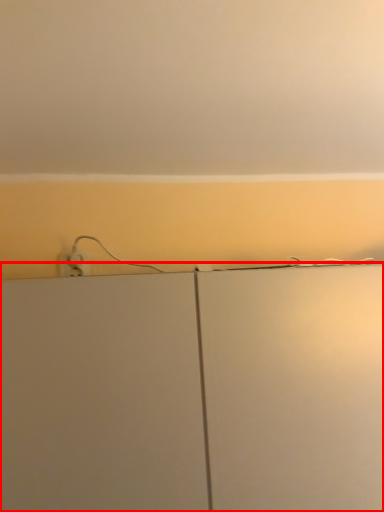
Question: From the image, what is the correct spatial relationship of cabinetry (annotated by the red box) in relation to backdrop?

Choices:
 (A) left
 (B) right

Answer: (A)